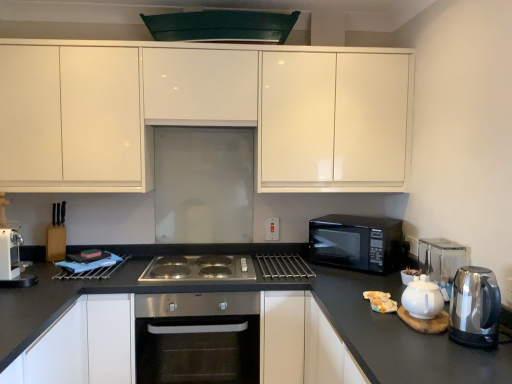
Question: From a real-world perspective, is black glossy microwave at right positioned over white glossy cabinet at lower left, arranged as the 1th cabinetry when ordered from the bottom, based on gravity?

Choices:
 (A) yes
 (B) no

Answer: (A)

Question: Is black glossy microwave at right next to white glossy cabinet at lower left, arranged as the 1th cabinetry when ordered from the bottom, and touching it?

Choices:
 (A) no
 (B) yes

Answer: (A)

Question: Can white glossy cabinet at lower left, which is the 2th cabinetry in top-to-bottom order, be found inside black glossy microwave at right?

Choices:
 (A) no
 (B) yes

Answer: (A)

Question: Does black glossy microwave at right turn towards white glossy cabinet at lower left, arranged as the 1th cabinetry when ordered from the bottom?

Choices:
 (A) yes
 (B) no

Answer: (B)

Question: Is black glossy microwave at right smaller than white glossy cabinet at lower left, which is the 2th cabinetry in top-to-bottom order?

Choices:
 (A) yes
 (B) no

Answer: (A)

Question: Is black glossy microwave at right far away from white glossy cabinet at lower left, which is the 2th cabinetry in top-to-bottom order?

Choices:
 (A) no
 (B) yes

Answer: (B)

Question: From the image's perspective, is stainless steel kettle at right located above white plastic coffee machine at left?

Choices:
 (A) yes
 (B) no

Answer: (B)

Question: Is stainless steel kettle at right at the right side of white plastic coffee machine at left?

Choices:
 (A) no
 (B) yes

Answer: (B)

Question: Considering the relative sizes of stainless steel kettle at right and white plastic coffee machine at left in the image provided, is stainless steel kettle at right taller than white plastic coffee machine at left?

Choices:
 (A) yes
 (B) no

Answer: (B)

Question: Does stainless steel kettle at right have a greater width compared to white plastic coffee machine at left?

Choices:
 (A) no
 (B) yes

Answer: (A)

Question: Can white plastic coffee machine at left be found inside stainless steel kettle at right?

Choices:
 (A) yes
 (B) no

Answer: (B)

Question: From a real-world perspective, is stainless steel kettle at right under white plastic coffee machine at left?

Choices:
 (A) no
 (B) yes

Answer: (B)

Question: Can you confirm if white glossy teapot at right is positioned to the left of green matte exhaust hood at upper center?

Choices:
 (A) yes
 (B) no

Answer: (B)